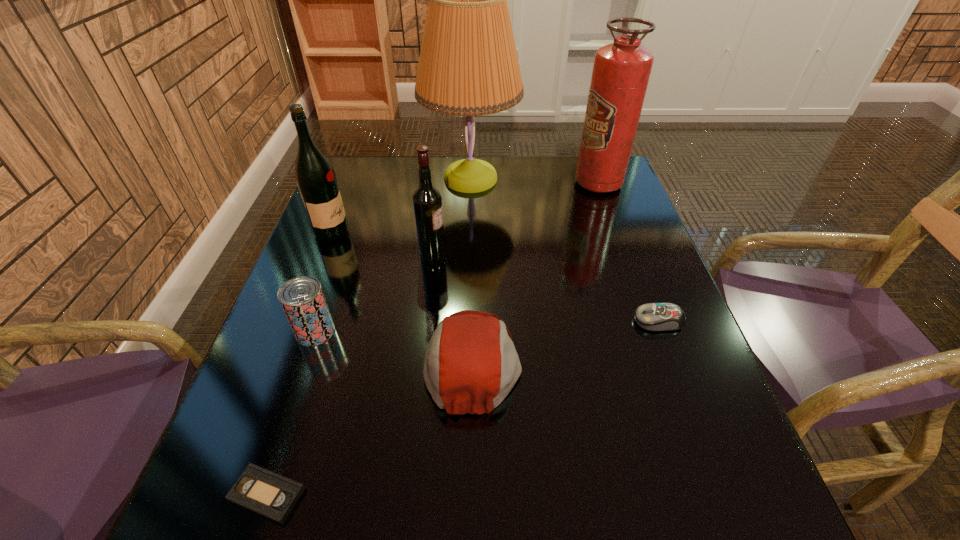
I want to click on object situated at the near left corner, so click(x=273, y=496).

Where is `object located in the far right corner section of the desktop`? object located in the far right corner section of the desktop is located at coordinates (621, 70).

The width and height of the screenshot is (960, 540). I want to click on vacant space at the far edge of the desktop, so click(540, 175).

Locate an element on the screen. blank space at the near edge of the desktop is located at coordinates (352, 507).

This screenshot has width=960, height=540. Find the location of `blank space at the left edge of the desktop`. blank space at the left edge of the desktop is located at coordinates (333, 347).

This screenshot has width=960, height=540. I want to click on free space at the right edge, so click(x=650, y=284).

At what (x,y) coordinates should I click in order to perform the action: click on vacant point at the far left corner. Please return your answer as a coordinate pair (x, y). The image size is (960, 540). Looking at the image, I should click on (384, 179).

At what (x,y) coordinates should I click in order to perform the action: click on vacant space that's between the wine bottle and the third farthest object. Please return your answer as a coordinate pair (x, y). The width and height of the screenshot is (960, 540). Looking at the image, I should click on (382, 245).

The height and width of the screenshot is (540, 960). I want to click on free area in between the sixth nearest object and the lamp, so click(401, 206).

Image resolution: width=960 pixels, height=540 pixels. In order to click on unoccupied area between the liquor and the videotape in this screenshot , I will do `click(300, 363)`.